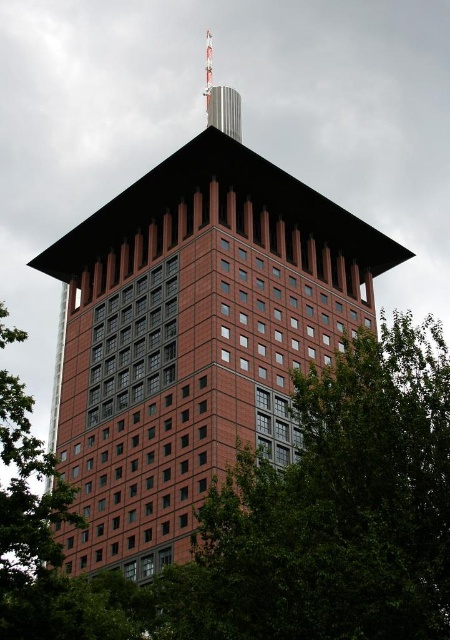
Question: From the image, what is the correct spatial relationship of green leafy tree at center in relation to green leafy tree at lower left?

Choices:
 (A) below
 (B) above

Answer: (B)

Question: Which point is closer to the camera taking this photo?

Choices:
 (A) (12, 333)
 (B) (198, 618)

Answer: (B)

Question: Which object is closer to the camera taking this photo?

Choices:
 (A) green leafy tree at lower left
 (B) green leafy tree at center

Answer: (B)

Question: Is green leafy tree at center to the right of green leafy tree at lower left from the viewer's perspective?

Choices:
 (A) yes
 (B) no

Answer: (A)

Question: In this image, where is green leafy tree at center located relative to green leafy tree at lower left?

Choices:
 (A) right
 (B) left

Answer: (A)